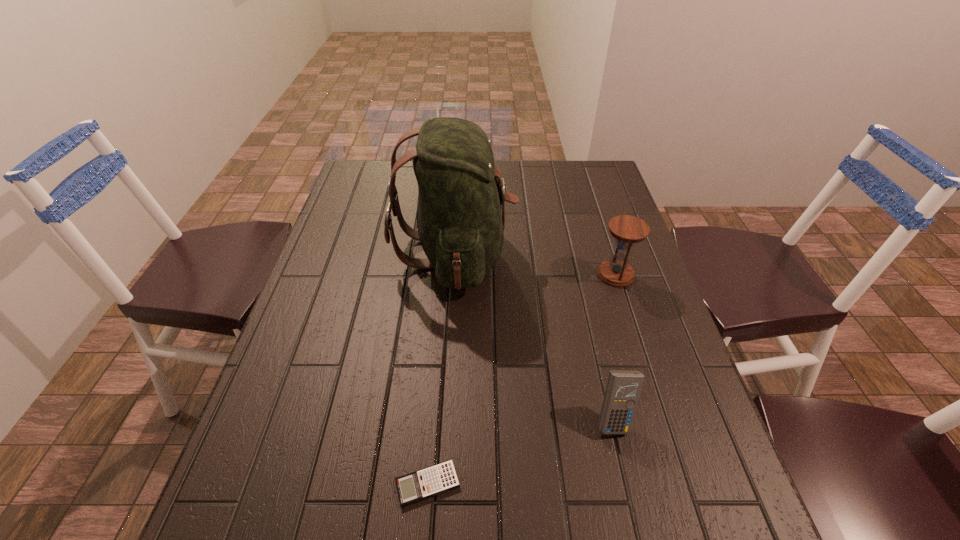
The width and height of the screenshot is (960, 540). I want to click on free location that satisfies the following two spatial constraints: 1. on the open flap of the backpack; 2. on the front side of the left calculator, so click(441, 484).

Where is `free location that satisfies the following two spatial constraints: 1. on the back side of the second tallest object; 2. on the right side of the shortest object`? free location that satisfies the following two spatial constraints: 1. on the back side of the second tallest object; 2. on the right side of the shortest object is located at coordinates (444, 274).